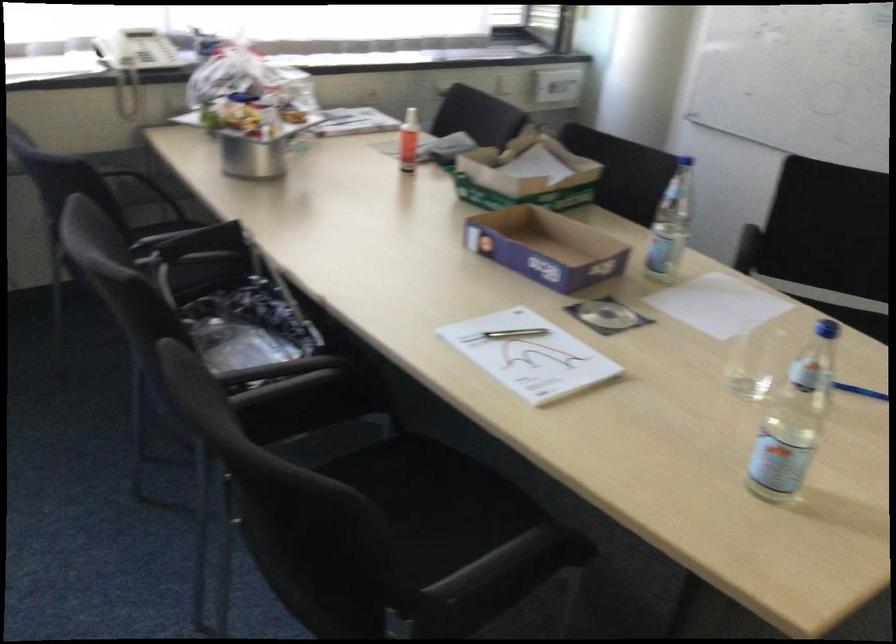
The image size is (896, 644). Describe the element at coordinates (606, 315) in the screenshot. I see `a silver CD` at that location.